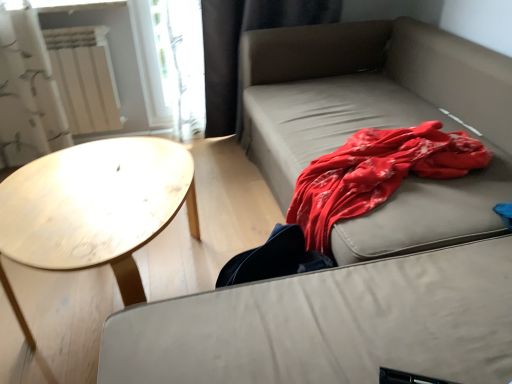
What do you see at coordinates (96, 206) in the screenshot?
I see `light wood/texture coffee table at left` at bounding box center [96, 206].

Locate an element on the screen. black fabric curtain at upper left is located at coordinates (238, 47).

Which is further, (99, 131) or (305, 0)?

The point (99, 131) is behind.

Can you confirm if white matte radiator at upper left is taller than black fabric curtain at upper left?

No, white matte radiator at upper left is not taller than black fabric curtain at upper left.

Relative to black fabric curtain at upper left, is white matte radiator at upper left in front or behind?

Clearly, white matte radiator at upper left is behind black fabric curtain at upper left.

Is white matte radiator at upper left inside or outside of black fabric curtain at upper left?

white matte radiator at upper left is located beyond the bounds of black fabric curtain at upper left.

The height and width of the screenshot is (384, 512). I want to click on curtain behind the matte beige studio couch at upper right, so 238,47.

Based on the photo, between matte beige studio couch at upper right and black fabric curtain at upper left, which one has smaller width?

black fabric curtain at upper left is thinner.

From a real-world perspective, is matte beige studio couch at upper right positioned under black fabric curtain at upper left based on gravity?

Yes.

Is matte beige studio couch at upper right touching black fabric curtain at upper left?

No, matte beige studio couch at upper right is not in contact with black fabric curtain at upper left.

Considering the relative sizes of light wood/texture coffee table at left and white matte radiator at upper left in the image provided, is light wood/texture coffee table at left wider than white matte radiator at upper left?

Indeed, light wood/texture coffee table at left has a greater width compared to white matte radiator at upper left.

Which of these two, light wood/texture coffee table at left or white matte radiator at upper left, is smaller?

white matte radiator at upper left is smaller.

Where is `radiator behind the light wood/texture coffee table at left`? radiator behind the light wood/texture coffee table at left is located at coordinates (85, 78).

In terms of height, does light wood/texture coffee table at left look taller or shorter compared to white matte radiator at upper left?

Considering their sizes, light wood/texture coffee table at left has less height than white matte radiator at upper left.

There is a matte beige studio couch at upper right. Where is `radiator above it (from a real-world perspective)`? The width and height of the screenshot is (512, 384). radiator above it (from a real-world perspective) is located at coordinates (85, 78).

In terms of size, does matte beige studio couch at upper right appear bigger or smaller than white matte radiator at upper left?

Considering their sizes, matte beige studio couch at upper right takes up more space than white matte radiator at upper left.

Are matte beige studio couch at upper right and white matte radiator at upper left located far from each other?

Indeed, matte beige studio couch at upper right is not near white matte radiator at upper left.

Consider the image. Is light wood/texture coffee table at left with black fabric curtain at upper left?

No, light wood/texture coffee table at left is not beside black fabric curtain at upper left.

Is the position of light wood/texture coffee table at left more distant than that of black fabric curtain at upper left?

That is False.

At what (x,y) coordinates should I click in order to perform the action: click on curtain above the light wood/texture coffee table at left (from the image's perspective). Please return your answer as a coordinate pair (x, y). The width and height of the screenshot is (512, 384). Looking at the image, I should click on (238, 47).

Is light wood/texture coffee table at left wider or thinner than black fabric curtain at upper left?

light wood/texture coffee table at left is wider than black fabric curtain at upper left.

Considering the points (62, 38) and (112, 255), which point is in front, point (62, 38) or point (112, 255)?

Positioned in front is point (112, 255).

Is white matte radiator at upper left inside the boundaries of light wood/texture coffee table at left, or outside?

white matte radiator at upper left exists outside the volume of light wood/texture coffee table at left.

Is the depth of white matte radiator at upper left greater than that of light wood/texture coffee table at left?

Yes, white matte radiator at upper left is further from the camera.

Looking at this image, from a real-world perspective, which object rests below the other?

From a 3D spatial view, light wood/texture coffee table at left is below.

What's the angular difference between white matte radiator at upper left and matte beige studio couch at upper right's facing directions?

The angular difference between white matte radiator at upper left and matte beige studio couch at upper right is 88 degrees.

Is white matte radiator at upper left far from matte beige studio couch at upper right?

white matte radiator at upper left is positioned a significant distance from matte beige studio couch at upper right.

Which object is closer to the camera taking this photo, white matte radiator at upper left or matte beige studio couch at upper right?

Positioned in front is matte beige studio couch at upper right.

Considering the positions of point (63, 34) and point (474, 202), is point (63, 34) closer or farther from the camera than point (474, 202)?

Point (63, 34).

Identify the location of radiator to the left of black fabric curtain at upper left. This screenshot has width=512, height=384. (85, 78).

Identify the location of studio couch on the right side of black fabric curtain at upper left. The image size is (512, 384). (380, 122).

Based on their spatial positions, is matte beige studio couch at upper right or black fabric curtain at upper left further from light wood/texture coffee table at left?

Based on the image, black fabric curtain at upper left appears to be further to light wood/texture coffee table at left.

Looking at the image, which one is located closer to black fabric curtain at upper left, light wood/texture coffee table at left or matte beige studio couch at upper right?

Based on the image, matte beige studio couch at upper right appears to be nearer to black fabric curtain at upper left.

When comparing their distances from matte beige studio couch at upper right, does light wood/texture coffee table at left or white matte radiator at upper left seem closer?

light wood/texture coffee table at left is positioned closer to the anchor matte beige studio couch at upper right.

Based on their spatial positions, is white matte radiator at upper left or light wood/texture coffee table at left further from matte beige studio couch at upper right?

white matte radiator at upper left is further to matte beige studio couch at upper right.

Looking at the image, which one is located further to matte beige studio couch at upper right, black fabric curtain at upper left or white matte radiator at upper left?

white matte radiator at upper left is positioned further to the anchor matte beige studio couch at upper right.

Based on their spatial positions, is black fabric curtain at upper left or white matte radiator at upper left further from light wood/texture coffee table at left?

black fabric curtain at upper left.

Looking at the image, which one is located further to white matte radiator at upper left, light wood/texture coffee table at left or matte beige studio couch at upper right?

The object further to white matte radiator at upper left is matte beige studio couch at upper right.

Estimate the real-world distances between objects in this image. Which object is closer to light wood/texture coffee table at left, white matte radiator at upper left or black fabric curtain at upper left?

white matte radiator at upper left is closer to light wood/texture coffee table at left.

You are a GUI agent. You are given a task and a screenshot of the screen. Output one action in this format:
    pyautogui.click(x=<x>, y=<y>)
    Task: Click on the curtain located between white matte radiator at upper left and matte beige studio couch at upper right in the left-right direction
    Image resolution: width=512 pixels, height=384 pixels.
    Given the screenshot: What is the action you would take?
    pyautogui.click(x=238, y=47)

Find the location of a particular element. The height and width of the screenshot is (384, 512). curtain located between light wood/texture coffee table at left and white matte radiator at upper left in the depth direction is located at coordinates (238, 47).

This screenshot has width=512, height=384. What are the coordinates of `coffee table between white matte radiator at upper left and matte beige studio couch at upper right in the horizontal direction` in the screenshot? It's located at (96, 206).

Where is `coffee table between matte beige studio couch at upper right and black fabric curtain at upper left along the z-axis`? This screenshot has width=512, height=384. coffee table between matte beige studio couch at upper right and black fabric curtain at upper left along the z-axis is located at coordinates (96, 206).